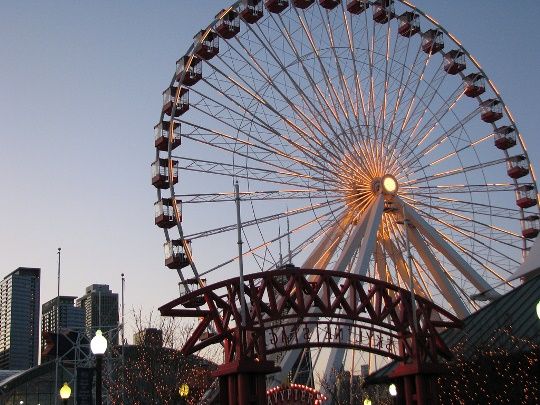
The width and height of the screenshot is (540, 405). I want to click on bright light, so click(x=393, y=189).